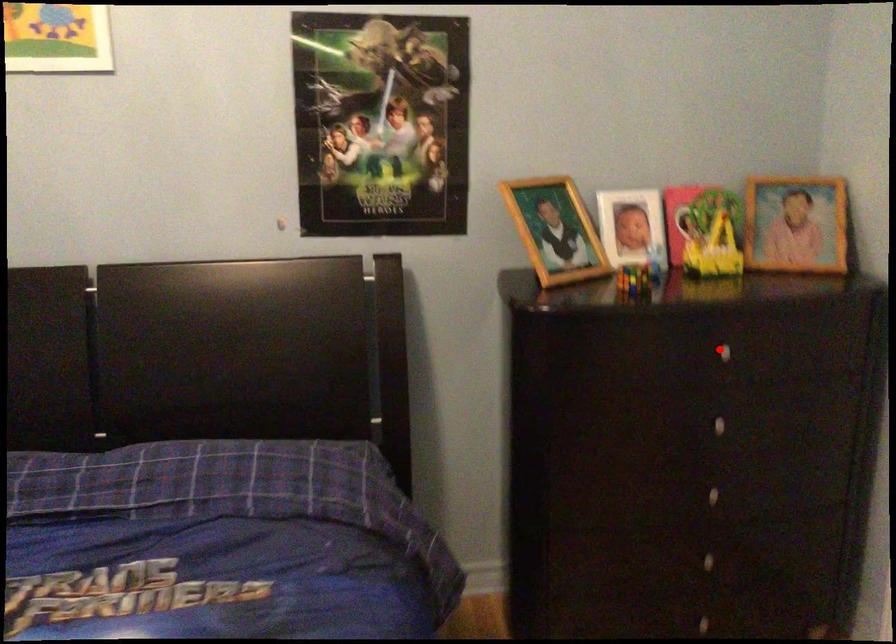
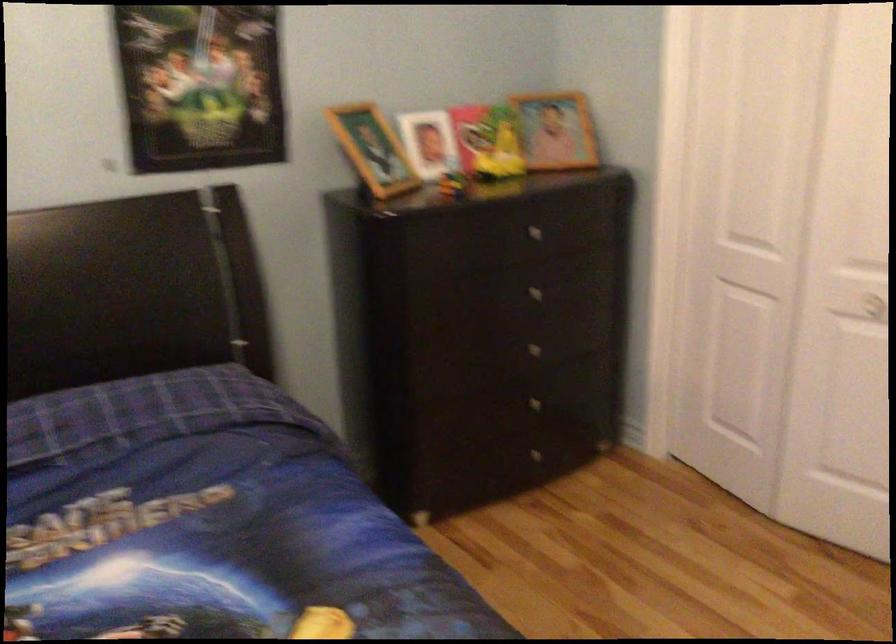
Question: I am providing you with two images of the same scene from different viewpoints. Image1 has a red point marked. In image2, the corresponding 3D location appears at what relative position? Reply with the corresponding letter.

Choices:
 (A) Closer
 (B) Farther

Answer: (B)